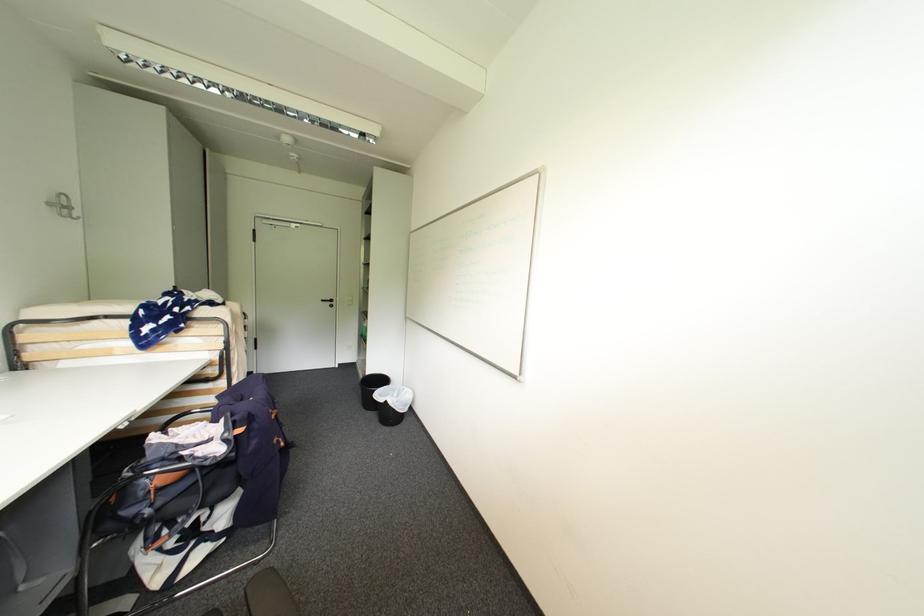
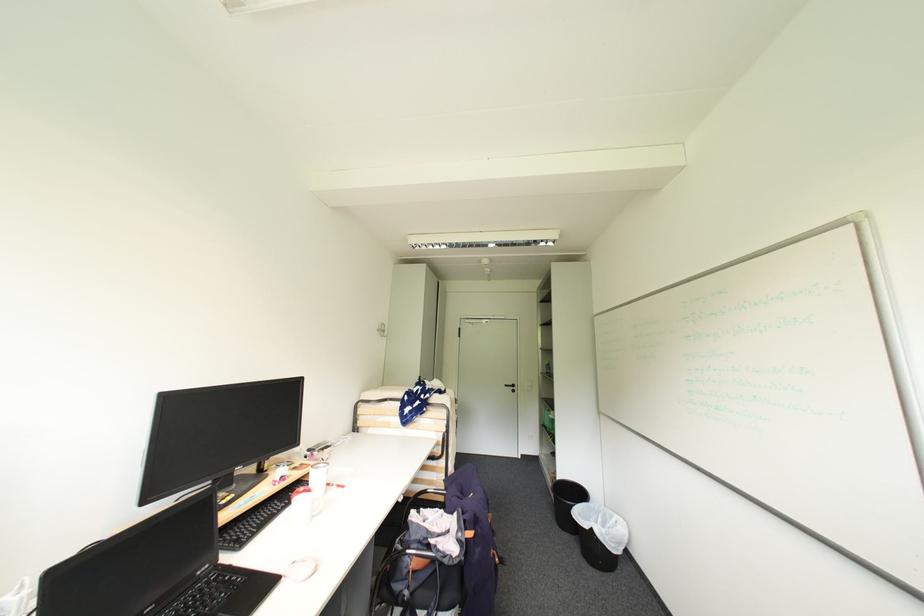
Find the pixel in the second image that matches (x=128, y=428) in the first image.

(407, 501)